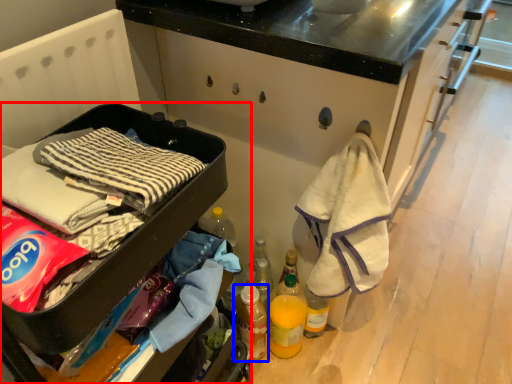
Question: Which point is closer to the camera, furniture (highlighted by a red box) or bottle (highlighted by a blue box)?

Choices:
 (A) furniture
 (B) bottle

Answer: (A)